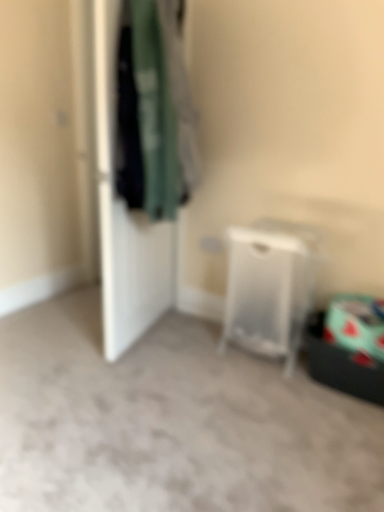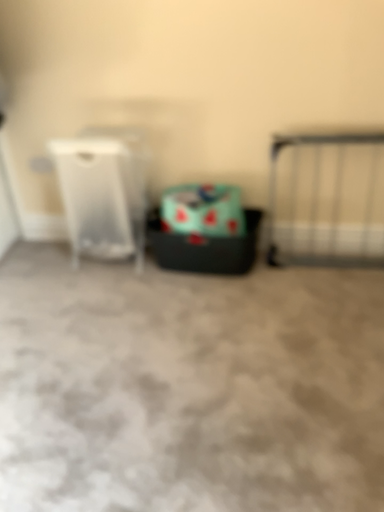
Question: Which way did the camera rotate in the video?

Choices:
 (A) rotated right
 (B) rotated left

Answer: (A)